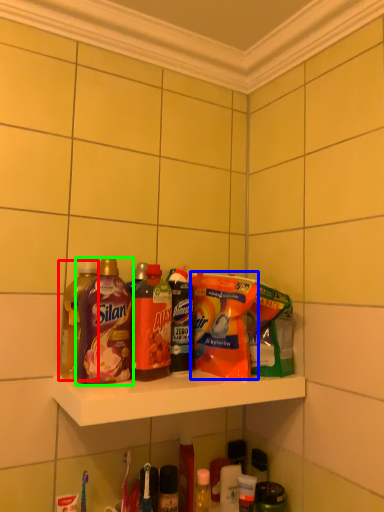
Question: Considering the real-world distances, which object is farthest from bottle (highlighted by a red box)? cleaning product (highlighted by a blue box) or bottle (highlighted by a green box)?

Choices:
 (A) cleaning product
 (B) bottle

Answer: (A)